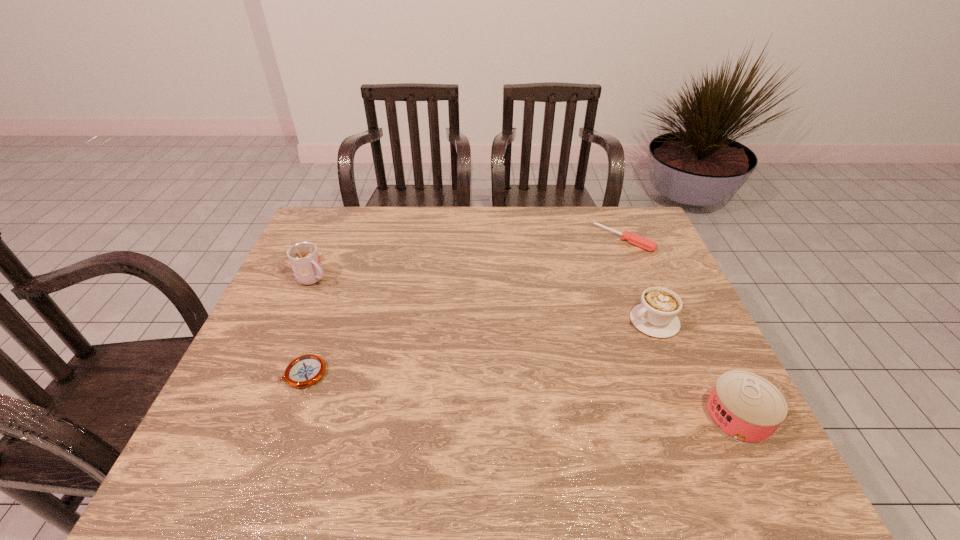
This screenshot has width=960, height=540. In the image, there is a desktop. Find the location of `vacant space at the right edge`. vacant space at the right edge is located at coordinates (618, 252).

Image resolution: width=960 pixels, height=540 pixels. In the image, there is a desktop. Identify the location of vacant space at the far left corner. (346, 210).

Where is `vacant area that lies between the nearest object and the screwdriver`? The image size is (960, 540). vacant area that lies between the nearest object and the screwdriver is located at coordinates (681, 328).

I want to click on vacant area between the screwdriver and the cappuccino, so click(x=638, y=280).

The height and width of the screenshot is (540, 960). Find the location of `free space between the fourth nearest object and the compass`. free space between the fourth nearest object and the compass is located at coordinates (309, 326).

This screenshot has height=540, width=960. Identify the location of vacant space in between the shortest object and the nearest object. (521, 395).

The width and height of the screenshot is (960, 540). I want to click on free space between the cup and the cappuccino, so click(484, 300).

Locate an element on the screen. This screenshot has width=960, height=540. vacant space that is in between the can and the cappuccino is located at coordinates (696, 369).

At what (x,y) coordinates should I click in order to perform the action: click on free spot between the farthest object and the compass. Please return your answer as a coordinate pair (x, y). Looking at the image, I should click on (464, 306).

Image resolution: width=960 pixels, height=540 pixels. In order to click on free point between the can and the compass in this screenshot , I will do `click(521, 395)`.